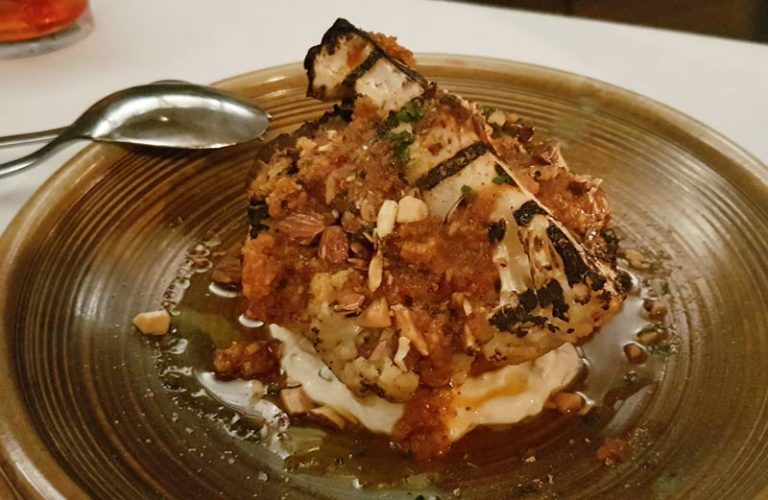
The height and width of the screenshot is (500, 768). In order to click on dark area behind table in this screenshot , I will do `click(702, 16)`.